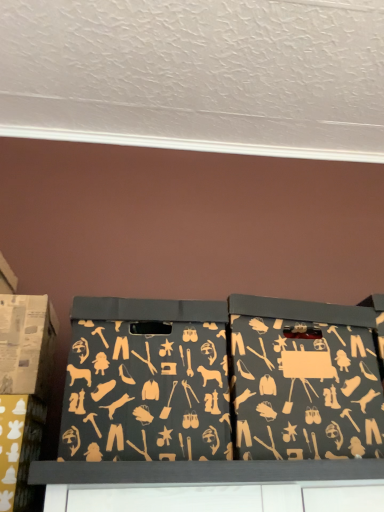
Question: Does matte black storage box at center, the second box viewed from the right, lie behind matte black box at center, the first box when ordered from right to left?

Choices:
 (A) yes
 (B) no

Answer: (B)

Question: From the image's perspective, does matte black storage box at center, the third box when ordered from left to right, appear lower than matte black box at center, positioned as the fourth box in left-to-right order?

Choices:
 (A) yes
 (B) no

Answer: (B)

Question: Is matte black storage box at center, the third box when ordered from left to right, at the right side of matte black box at center, positioned as the fourth box in left-to-right order?

Choices:
 (A) no
 (B) yes

Answer: (A)

Question: Can you confirm if matte black storage box at center, the second box viewed from the right, is positioned to the left of matte black box at center, positioned as the fourth box in left-to-right order?

Choices:
 (A) yes
 (B) no

Answer: (A)

Question: Is matte black storage box at center, the third box when ordered from left to right, not within matte black box at center, positioned as the fourth box in left-to-right order?

Choices:
 (A) yes
 (B) no

Answer: (A)

Question: Is matte black storage box at center, the second box viewed from the right, in contact with matte black box at center, positioned as the fourth box in left-to-right order?

Choices:
 (A) yes
 (B) no

Answer: (B)

Question: From a real-world perspective, is matte cardboard box at left, positioned as the 1th box in left-to-right order, located higher than matte black storage bin at lower left, the 3th box viewed from the right?

Choices:
 (A) yes
 (B) no

Answer: (A)

Question: Is matte cardboard box at left, positioned as the 1th box in left-to-right order, bigger than matte black storage bin at lower left, the second box positioned from the left?

Choices:
 (A) no
 (B) yes

Answer: (B)

Question: Does matte cardboard box at left, which appears as the fourth box when viewed from the right, have a smaller size compared to matte black storage bin at lower left, the 3th box viewed from the right?

Choices:
 (A) no
 (B) yes

Answer: (A)

Question: From the image's perspective, is matte cardboard box at left, which appears as the fourth box when viewed from the right, above matte black storage bin at lower left, the second box positioned from the left?

Choices:
 (A) yes
 (B) no

Answer: (A)

Question: Is matte cardboard box at left, positioned as the 1th box in left-to-right order, closer to the viewer compared to matte black storage bin at lower left, the 3th box viewed from the right?

Choices:
 (A) yes
 (B) no

Answer: (B)

Question: Could you tell me if matte cardboard box at left, which appears as the fourth box when viewed from the right, is turned towards matte black storage bin at lower left, the 3th box viewed from the right?

Choices:
 (A) no
 (B) yes

Answer: (A)

Question: Is matte cardboard box at left, positioned as the 1th box in left-to-right order, placed right next to matte black box at center, positioned as the fourth box in left-to-right order?

Choices:
 (A) no
 (B) yes

Answer: (A)